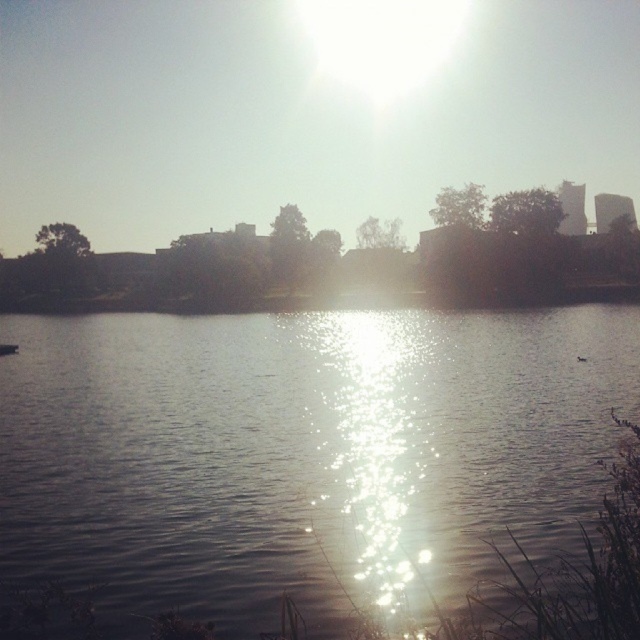
Question: Is silvery reflective water at center bigger than sparkling water at center?

Choices:
 (A) no
 (B) yes

Answer: (B)

Question: Which object appears closest to the camera in this image?

Choices:
 (A) sparkling water at center
 (B) silvery reflective water at center

Answer: (A)

Question: Among these points, which one is nearest to the camera?

Choices:
 (A) (340, 429)
 (B) (12, 492)

Answer: (B)

Question: Does silvery reflective water at center appear on the right side of sparkling water at center?

Choices:
 (A) no
 (B) yes

Answer: (A)

Question: Does silvery reflective water at center have a larger size compared to sparkling water at center?

Choices:
 (A) yes
 (B) no

Answer: (A)

Question: Which point appears closest to the camera in this image?

Choices:
 (A) (401, 573)
 (B) (464, 552)

Answer: (A)